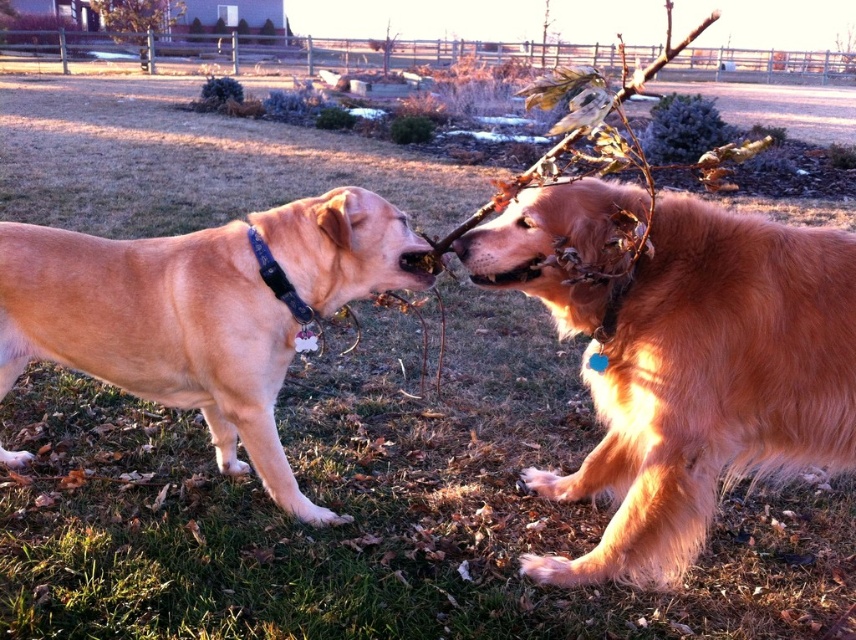
Question: Which point appears closest to the camera in this image?

Choices:
 (A) (658, 61)
 (B) (518, 272)
 (C) (764, 451)
 (D) (296, 227)

Answer: (A)

Question: Is golden fur dog at left below fuzzy golden fur at center?

Choices:
 (A) yes
 (B) no

Answer: (A)

Question: Does brown textured branch at center appear on the left side of fuzzy golden fur at center?

Choices:
 (A) yes
 (B) no

Answer: (B)

Question: Is brown textured branch at center smaller than fuzzy golden fur at center?

Choices:
 (A) yes
 (B) no

Answer: (B)

Question: Estimate the real-world distances between objects in this image. Which object is closer to the golden fur dog at right?

Choices:
 (A) golden fur dog at left
 (B) brown textured branch at center
 (C) fuzzy golden fur at center

Answer: (C)

Question: Which point is closer to the camera taking this photo?

Choices:
 (A) (538, 241)
 (B) (514, 276)
 (C) (282, 236)

Answer: (A)